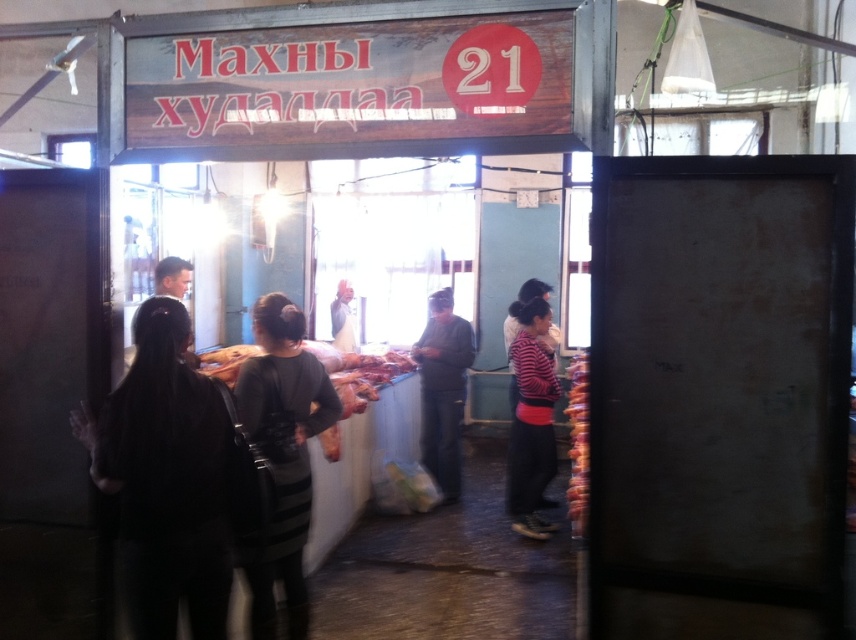
You are a customer at the meat market and see a dark gray striped dress at center and raw meat at center. Which item is taller?

The dark gray striped dress at center is taller than the raw meat at center.

You are a customer at the meat market stall labeled with the signboard. You want to buy some meat. Where should you look to find the raw meat at center?

The raw meat at center is located at point (360,372).